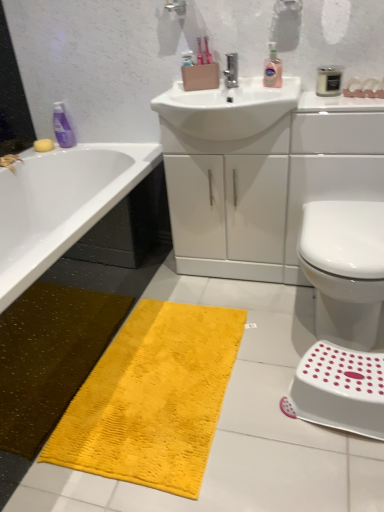
The height and width of the screenshot is (512, 384). I want to click on free space on the front side of white plastic step stool at lower right, so click(x=335, y=471).